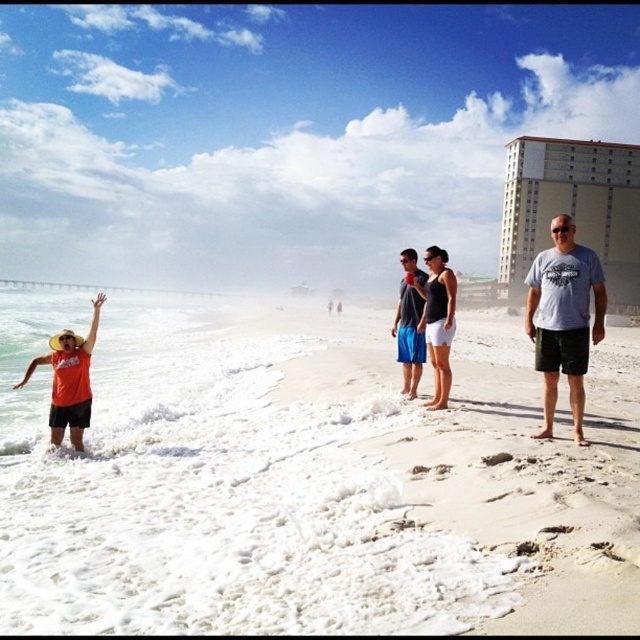
Question: Considering the relative positions of orange t-shirt at left and blue cotton shorts at center in the image provided, where is orange t-shirt at left located with respect to blue cotton shorts at center?

Choices:
 (A) below
 (B) above

Answer: (A)

Question: Estimate the real-world distances between objects in this image. Which object is closer to the white cotton shorts at center?

Choices:
 (A) blue cotton shorts at center
 (B) white sandy beach at lower left

Answer: (A)

Question: Does gray cotton t-shirt at center-right have a lesser width compared to white cotton shorts at center?

Choices:
 (A) yes
 (B) no

Answer: (B)

Question: Which is farther from the gray cotton t-shirt at center-right?

Choices:
 (A) white cotton shorts at center
 (B) blue cotton shorts at center
 (C) white sandy beach at lower left
 (D) orange t-shirt at left

Answer: (C)

Question: Which is nearer to the white cotton shorts at center?

Choices:
 (A) gray cotton t-shirt at center-right
 (B) blue cotton shorts at center
 (C) white sandy beach at lower left
 (D) orange t-shirt at left

Answer: (B)

Question: Is the position of white cotton shorts at center more distant than that of blue cotton shorts at center?

Choices:
 (A) yes
 (B) no

Answer: (B)